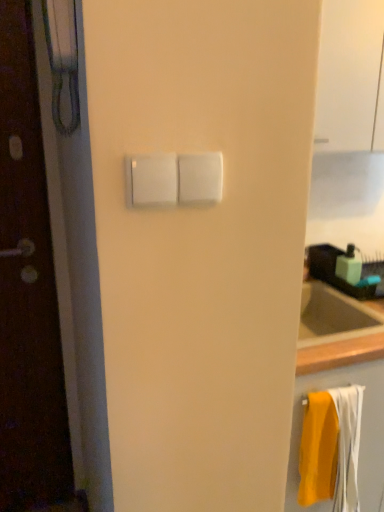
Question: In terms of size, does yellow fabric towel at lower right appear bigger or smaller than green matte soap dispenser at upper right?

Choices:
 (A) big
 (B) small

Answer: (A)

Question: From the image's perspective, is yellow fabric towel at lower right positioned above or below green matte soap dispenser at upper right?

Choices:
 (A) above
 (B) below

Answer: (B)

Question: Estimate the real-world distances between objects in this image. Which object is closer to the transparent glass door at upper right?

Choices:
 (A) white plastic light switch at center
 (B) yellow fabric towel at lower right
 (C) green matte soap dispenser at upper right

Answer: (C)

Question: Which of these objects is positioned farthest from the green matte soap dispenser at upper right?

Choices:
 (A) white plastic light switch at center
 (B) yellow fabric towel at lower right
 (C) transparent glass door at upper right

Answer: (A)